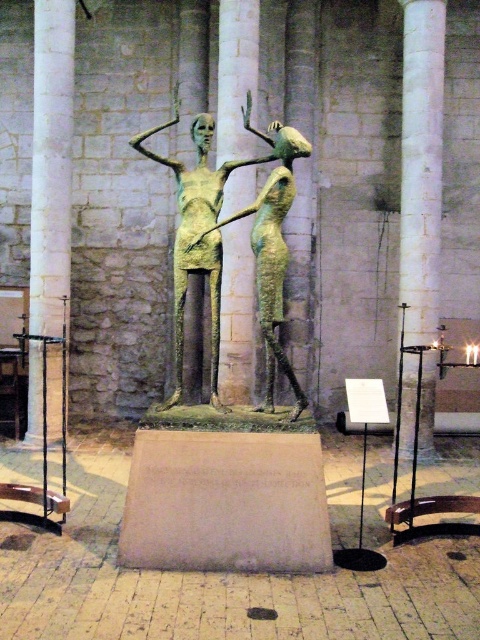
Question: Which of the following is the closest to the observer?

Choices:
 (A) white marble pillar at right
 (B) green patina bronze sculpture at center
 (C) bronze statue at center
 (D) white stone column at left

Answer: (B)

Question: Which point appears farthest from the camera in this image?

Choices:
 (A) (287, 177)
 (B) (250, 225)
 (C) (408, 120)
 (D) (41, 237)

Answer: (D)

Question: Which point is closer to the camera?

Choices:
 (A) bronze statue at center
 (B) green patina bronze sculpture at center
 (C) white stone column at left
 (D) white marble pillar at right

Answer: (B)

Question: Does white stone column at left appear on the right side of bronze statue at center?

Choices:
 (A) no
 (B) yes

Answer: (A)

Question: Can you confirm if green patina bronze sculpture at center is positioned to the right of bronze statue at center?

Choices:
 (A) no
 (B) yes

Answer: (A)

Question: Is white marble pillar at right bigger than green patina bronze sculpture at center?

Choices:
 (A) no
 (B) yes

Answer: (A)